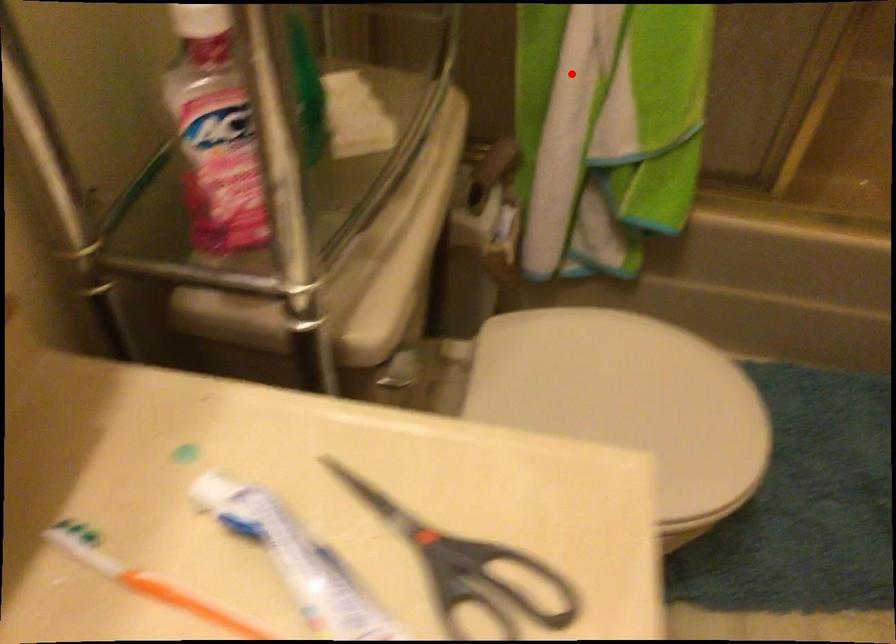
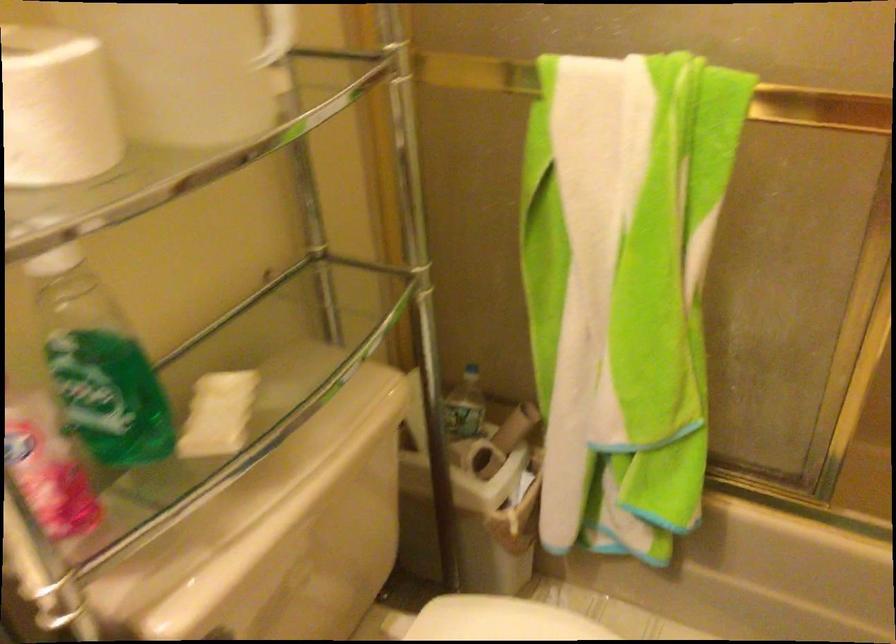
The point at the highlighted location is marked in the first image. Where is the corresponding point in the second image?

(575, 353)